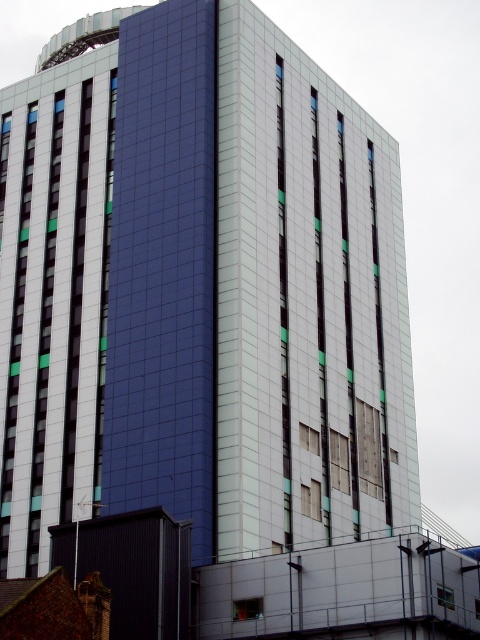
You are an architect evaluating the building design. You need to install a new sensor on the shorter transparent glass window. Which window should you choose between the transparent glass window at center and the transparent glass window at lower right?

The transparent glass window at center is shorter than the transparent glass window at lower right, so you should choose the transparent glass window at center to install the sensor.

You are standing in front of the building and want to locate the transparent glass window at center. According to the coordinates provided, where would you look? Please answer with a direction relative to the building.

The transparent glass window at center is located at coordinates point (248,609), which is near the bottom center of the building.

You are standing in front of the modern multi story building and see two points marked on its facade. The first point is at coordinates point (257, 612) and the second is at point (311, 451). Which of these points is closer to you?

Point (257, 612) is in front of point (311, 451), so it is closer to you.